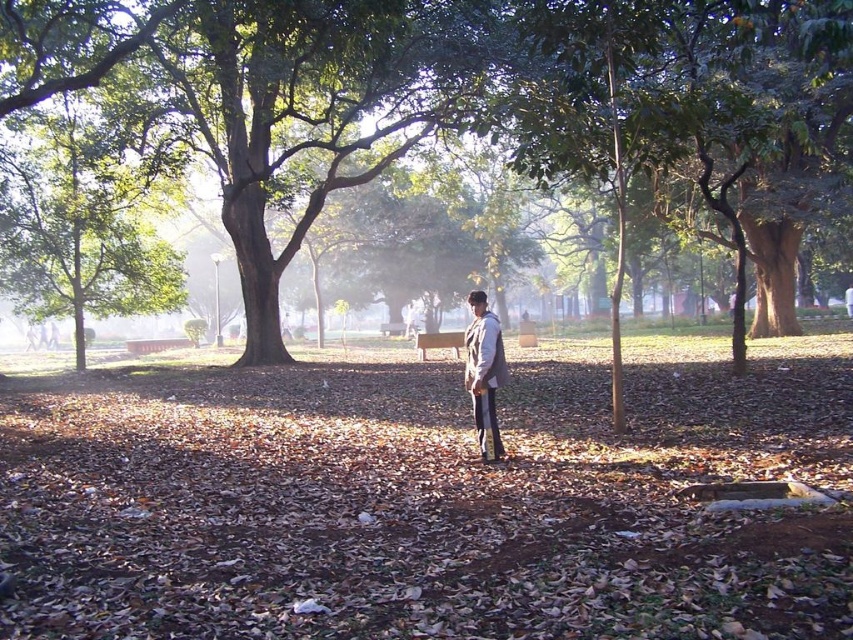
You are a hiker who has just arrived at the park and wants to take a photo of the green leafy tree at center and the light brown leather jacket at center. To frame the shot properly, which object should be placed to the left in your camera viewfinder?

The green leafy tree at center should be placed to the left in your camera viewfinder because it is positioned on the left side of the light brown leather jacket at center according to the description.

In the scene shown: You are a photographer trying to capture a photo of the green leafy tree at center and the light brown leather jacket at center. Since you want both subjects to be in focus, you need to adjust your camera settings. Considering their sizes, which subject should you focus on first to ensure depth of field?

The green leafy tree at center is much taller than the light brown leather jacket at center, so you should focus on the green leafy tree at center first to ensure both are in focus.